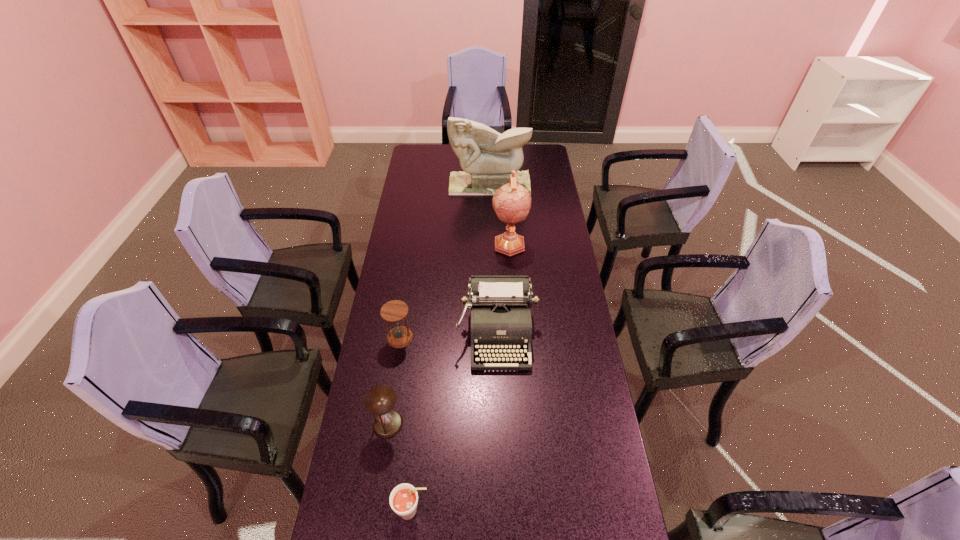
Where is `the farthest object`? The height and width of the screenshot is (540, 960). the farthest object is located at coordinates coord(486,157).

The height and width of the screenshot is (540, 960). In order to click on globe in this screenshot , I will do `click(512, 202)`.

The height and width of the screenshot is (540, 960). What are the coordinates of `typewriter` in the screenshot? It's located at (500, 305).

At what (x,y) coordinates should I click in order to perform the action: click on the farther hourglass. Please return your answer as a coordinate pair (x, y). The height and width of the screenshot is (540, 960). Looking at the image, I should click on (394, 311).

The width and height of the screenshot is (960, 540). In order to click on the second nearest object in this screenshot , I will do `click(380, 400)`.

Where is `the nearest object`? This screenshot has height=540, width=960. the nearest object is located at coordinates (403, 499).

Find the location of `blank area located on the base of the farthest object`. blank area located on the base of the farthest object is located at coordinates (491, 210).

Where is `vacant space located on the front-facing side of the second farthest object`? Image resolution: width=960 pixels, height=540 pixels. vacant space located on the front-facing side of the second farthest object is located at coordinates (512, 282).

This screenshot has height=540, width=960. What are the coordinates of `blank space located on the front-facing side of the typewriter` in the screenshot? It's located at (499, 390).

Where is `vacant region located 0.230m on the right of the farther hourglass`? The width and height of the screenshot is (960, 540). vacant region located 0.230m on the right of the farther hourglass is located at coordinates (476, 338).